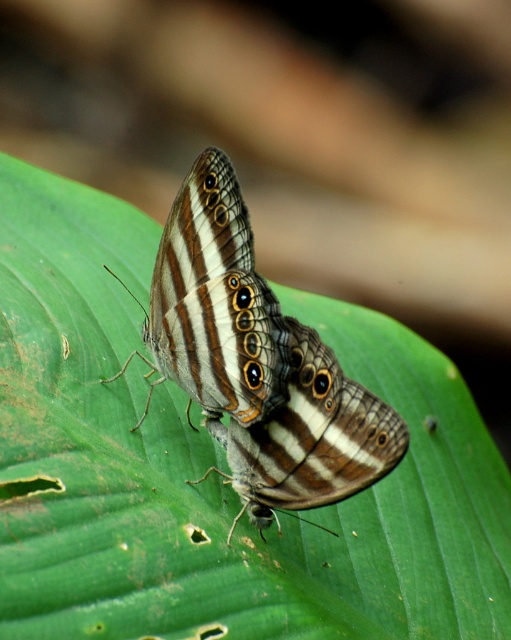
Question: Is shiny brown butterfly at center wider than brown striped butterfly at center?

Choices:
 (A) yes
 (B) no

Answer: (B)

Question: Is shiny brown butterfly at center to the right of brown striped butterfly at center from the viewer's perspective?

Choices:
 (A) yes
 (B) no

Answer: (B)

Question: Which of the following is the farthest from the observer?

Choices:
 (A) (274, 310)
 (B) (252, 518)

Answer: (B)

Question: Which point is closer to the camera?

Choices:
 (A) brown striped butterfly at center
 (B) shiny brown butterfly at center

Answer: (A)

Question: Is shiny brown butterfly at center below brown striped butterfly at center?

Choices:
 (A) yes
 (B) no

Answer: (B)

Question: Which point appears closest to the camera in this image?

Choices:
 (A) (170, 232)
 (B) (212, 420)

Answer: (A)